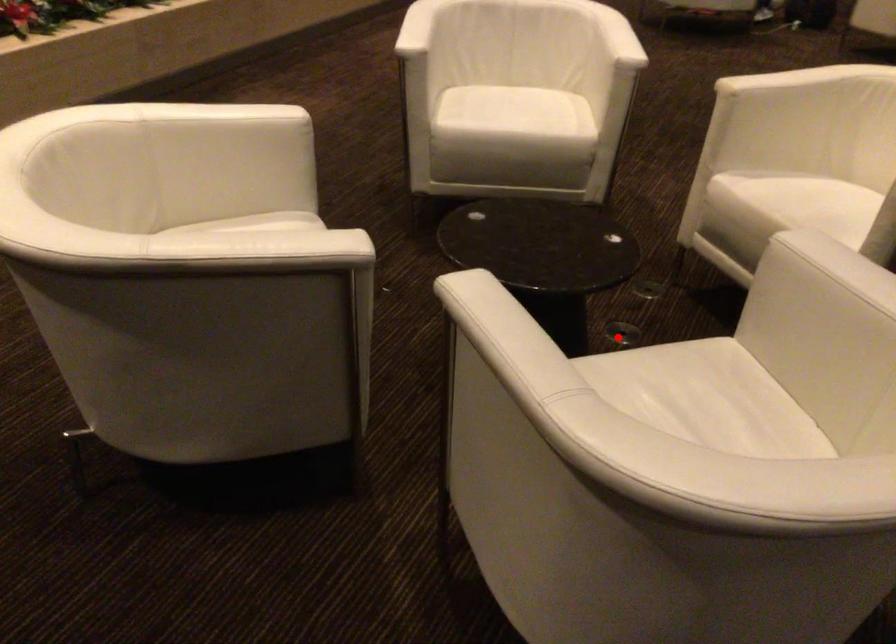
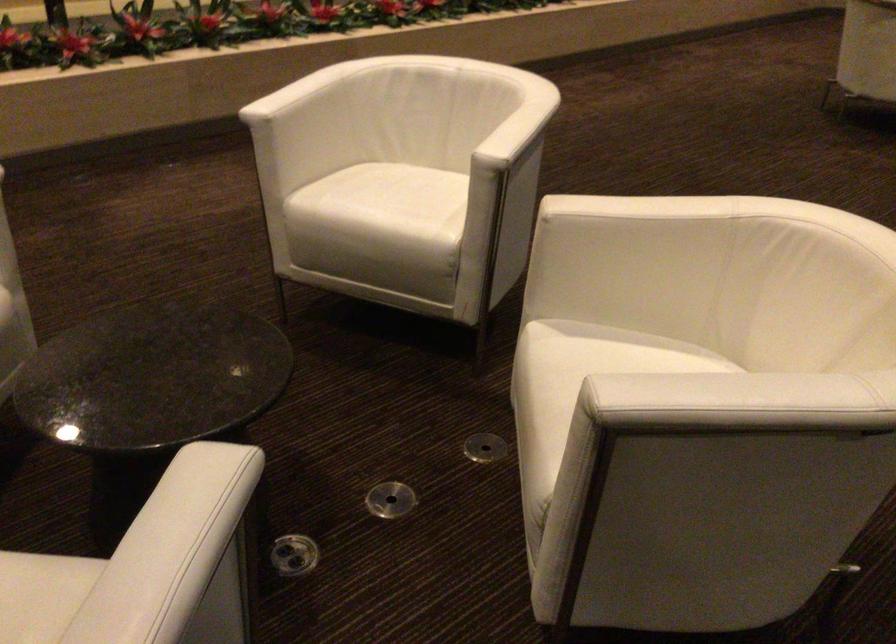
Question: I am providing you with two images of the same scene from different viewpoints. Given a red point in image1, look at the same physical point in image2. Is it:

Choices:
 (A) Closer to the viewpoint
 (B) Farther from the viewpoint

Answer: (A)